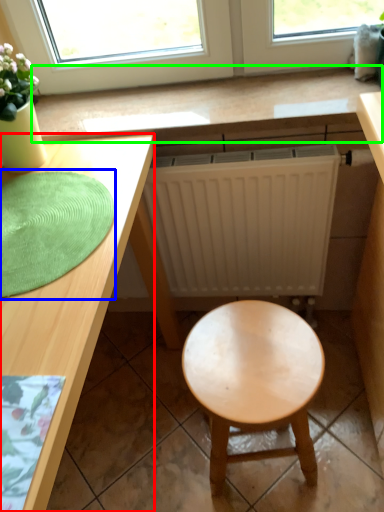
Question: Which object is the farthest from desk (highlighted by a red box)? Choose among these: mat (highlighted by a blue box) or counter top (highlighted by a green box).

Choices:
 (A) mat
 (B) counter top

Answer: (B)